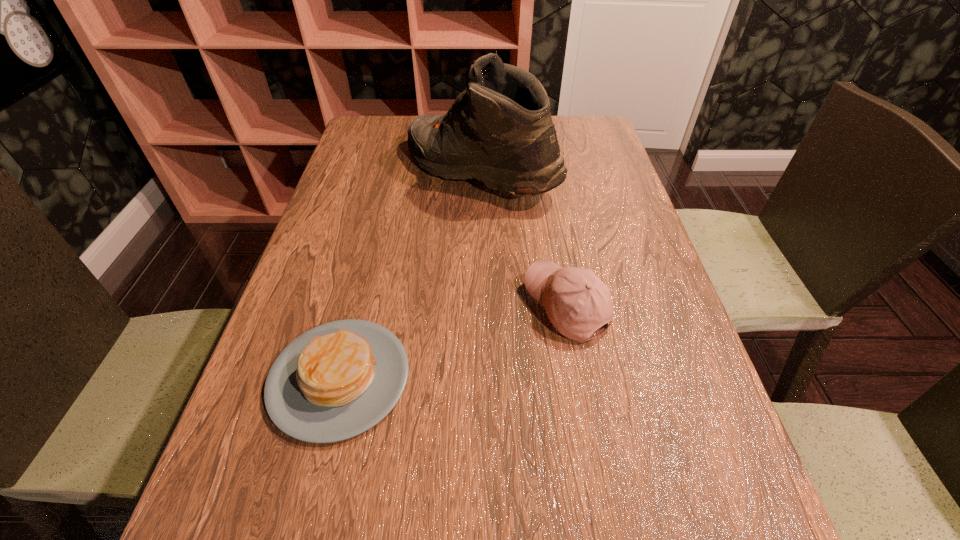
Find the location of a particular element. The image size is (960, 540). object that is at the left edge is located at coordinates (336, 381).

The height and width of the screenshot is (540, 960). I want to click on object present at the right edge, so 577,302.

Where is `free space at the left edge`? free space at the left edge is located at coordinates (x=327, y=468).

In order to click on vacant region at the right edge of the desktop in this screenshot , I will do `click(619, 264)`.

The height and width of the screenshot is (540, 960). I want to click on free space at the far left corner of the desktop, so click(383, 130).

Find the location of `blank area at the far right corner`. blank area at the far right corner is located at coordinates (562, 149).

Where is `vacant region between the farthest object and the shortest object`? The height and width of the screenshot is (540, 960). vacant region between the farthest object and the shortest object is located at coordinates (410, 275).

Identify the location of free space between the tallest object and the pancake. The width and height of the screenshot is (960, 540). (410, 275).

Locate an element on the screen. This screenshot has height=540, width=960. vacant space that is in between the shortest object and the baseball cap is located at coordinates (453, 342).

This screenshot has width=960, height=540. I want to click on free space between the baseball cap and the ski boot, so click(x=523, y=239).